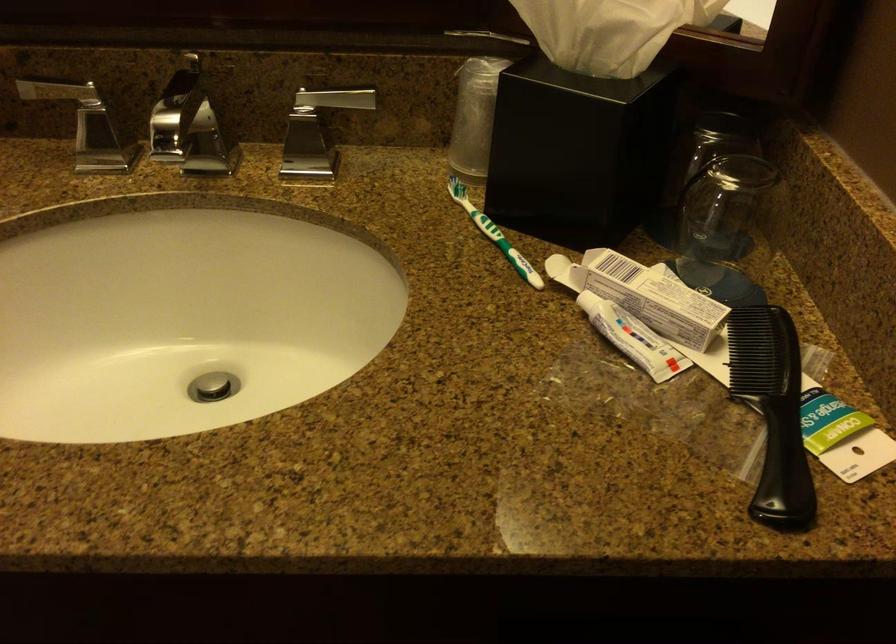
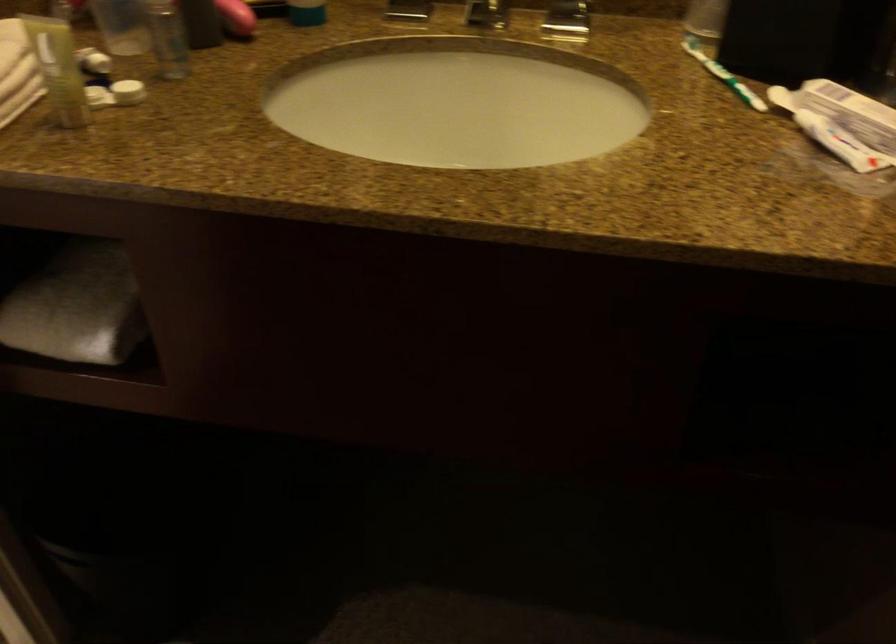
Locate, in the second image, the point that corresponds to the point at 305,164 in the first image.

(566, 21)